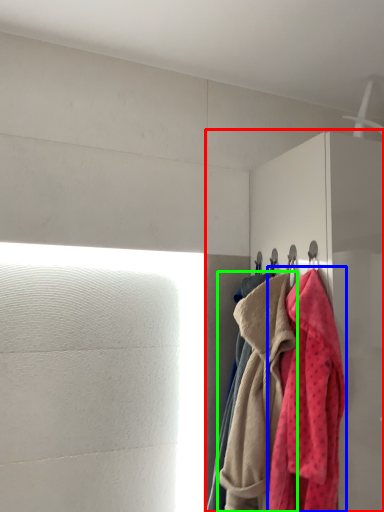
Question: Which object is positioned farthest from dresser (highlighted by a red box)? Select from towel (highlighted by a blue box) and towel (highlighted by a green box).

Choices:
 (A) towel
 (B) towel

Answer: (B)